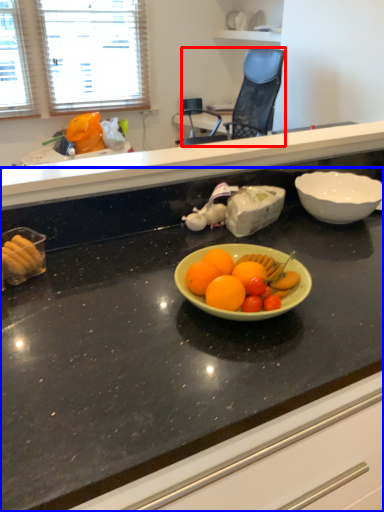
Question: Among these objects, which one is farthest to the camera, chair (highlighted by a red box) or countertop (highlighted by a blue box)?

Choices:
 (A) chair
 (B) countertop

Answer: (A)